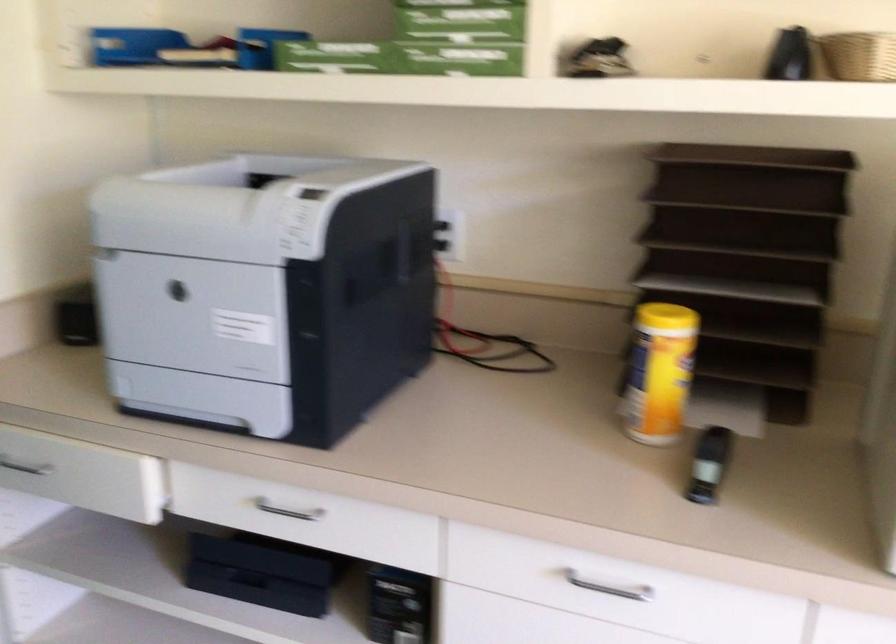
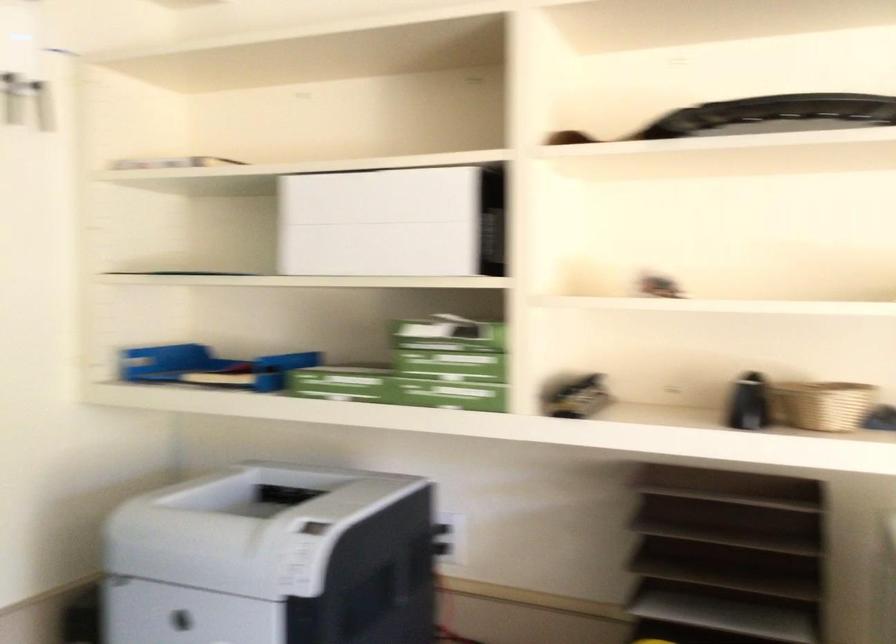
Question: How did the camera likely rotate?

Choices:
 (A) Left
 (B) Right
 (C) Up
 (D) Down

Answer: (C)